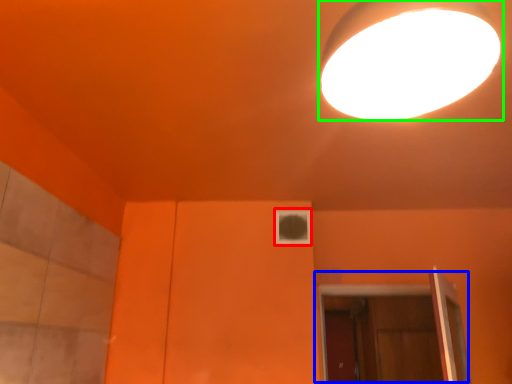
Question: Considering the real-world distances, which object is closest to window (highlighted by a red box)? door (highlighted by a blue box) or lamp (highlighted by a green box).

Choices:
 (A) door
 (B) lamp

Answer: (A)